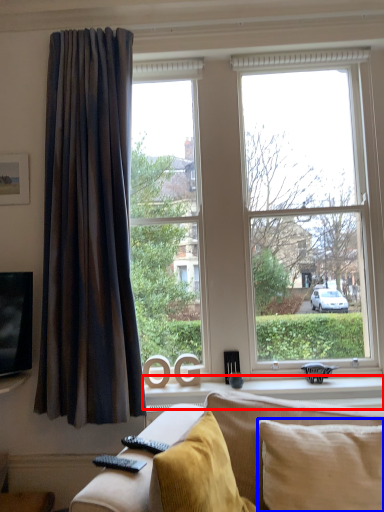
Question: Which object is further to the camera taking this photo, window sill (highlighted by a red box) or pillow (highlighted by a blue box)?

Choices:
 (A) window sill
 (B) pillow

Answer: (A)